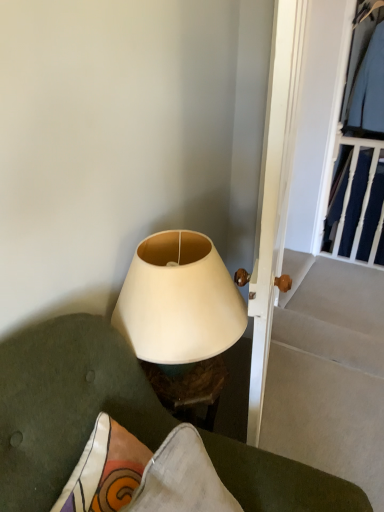
Question: From the image's perspective, is light blue fabric shirt at upper right, which ranks as the 1th clothing in top-to-bottom order, positioned above or below dark blue fabric at upper right, the second clothing from the top?

Choices:
 (A) above
 (B) below

Answer: (A)

Question: Is point (349, 103) positioned closer to the camera than point (349, 211)?

Choices:
 (A) closer
 (B) farther

Answer: (A)

Question: Estimate the real-world distances between objects in this image. Which object is farther from the light blue fabric shirt at upper right, arranged as the second clothing when ordered from the bottom?

Choices:
 (A) matte white lampshade at center
 (B) dark blue fabric at upper right, positioned as the first clothing in bottom-to-top order
 (C) white matte lampshade at center
 (D) white wooden door at center

Answer: (A)

Question: Which is nearer to the matte white lampshade at center?

Choices:
 (A) dark blue fabric at upper right, positioned as the first clothing in bottom-to-top order
 (B) light blue fabric shirt at upper right, arranged as the second clothing when ordered from the bottom
 (C) white wooden door at center
 (D) white matte lampshade at center

Answer: (D)